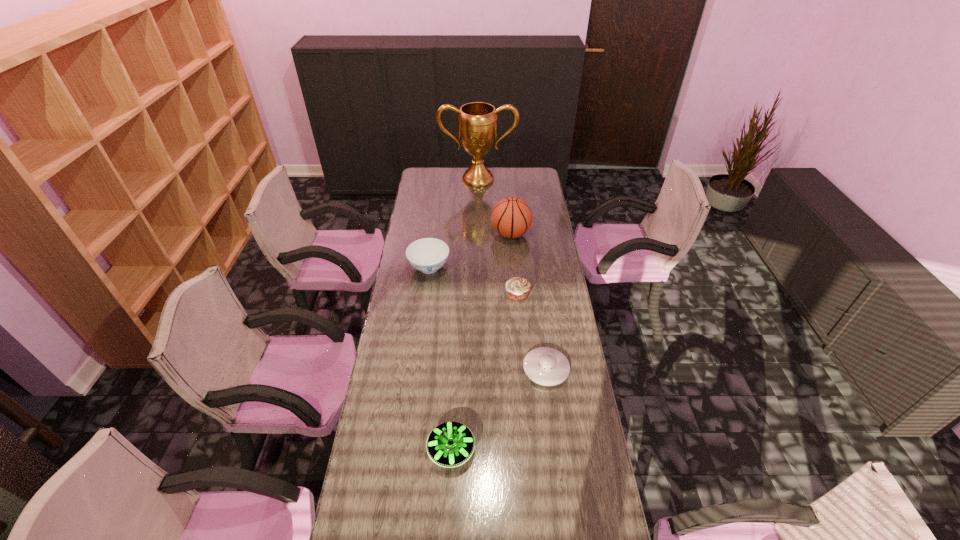
Find the location of a particular element. saucer that is the nearest to the trophy cup is located at coordinates (546, 366).

Identify which saucer is located as the second nearest to the tallest object. Please provide its 2D coordinates. Your answer should be formatted as a tuple, i.e. [(x, y)], where the tuple contains the x and y coordinates of a point satisfying the conditions above.

[(450, 444)]

This screenshot has height=540, width=960. In order to click on vacant space that satisfies the following two spatial constraints: 1. on the back side of the muffin; 2. on the right side of the taller saucer in this screenshot , I will do `click(459, 295)`.

Identify the location of vacant area that satisfies the following two spatial constraints: 1. on the front side of the shortest object; 2. on the left side of the chinaware. This screenshot has height=540, width=960. (417, 369).

Locate an element on the screen. free space in the image that satisfies the following two spatial constraints: 1. on the surface of the tallest object with symbols; 2. on the left side of the right saucer is located at coordinates tap(476, 369).

This screenshot has width=960, height=540. In order to click on free space that satisfies the following two spatial constraints: 1. on the side where the inflation valve is located; 2. on the left side of the second farthest object in this screenshot , I will do `click(521, 369)`.